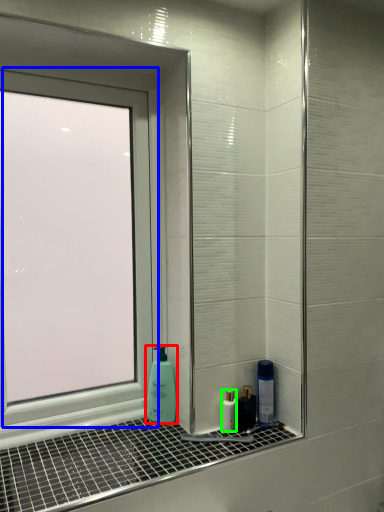
Question: Considering the real-world distances, which object is closest to soap dispenser (highlighted by a red box)? window (highlighted by a blue box) or mouthwash (highlighted by a green box).

Choices:
 (A) window
 (B) mouthwash

Answer: (B)